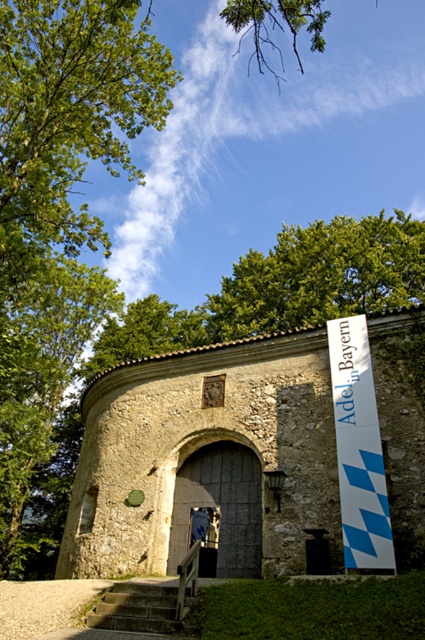
Question: From the image, what is the correct spatial relationship of green leafy tree at upper center in relation to concrete stairs at lower center?

Choices:
 (A) left
 (B) right

Answer: (B)

Question: Is blue and white checkered banner at right wider than concrete stairs at lower center?

Choices:
 (A) no
 (B) yes

Answer: (A)

Question: Which object appears closest to the camera in this image?

Choices:
 (A) concrete stairs at lower center
 (B) green leafy tree at upper center

Answer: (A)

Question: From the image, what is the correct spatial relationship of green leafy tree at upper center in relation to concrete stairs at lower center?

Choices:
 (A) right
 (B) left

Answer: (A)

Question: Among these points, which one is nearest to the camera?

Choices:
 (A) (158, 589)
 (B) (384, 230)
 (C) (379, 538)

Answer: (C)

Question: Which object appears closest to the camera in this image?

Choices:
 (A) blue and white checkered banner at right
 (B) concrete stairs at lower center
 (C) green leafy tree at upper center

Answer: (B)